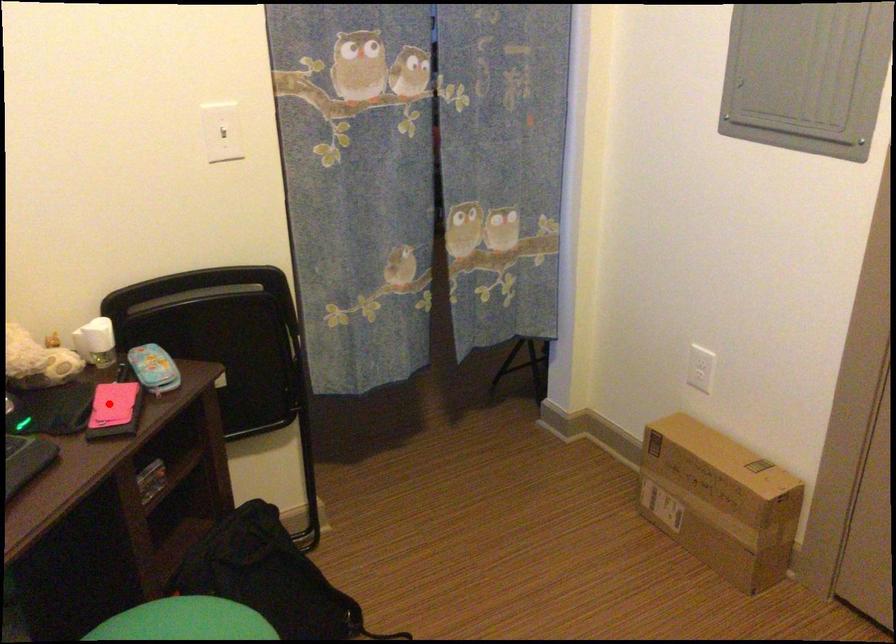
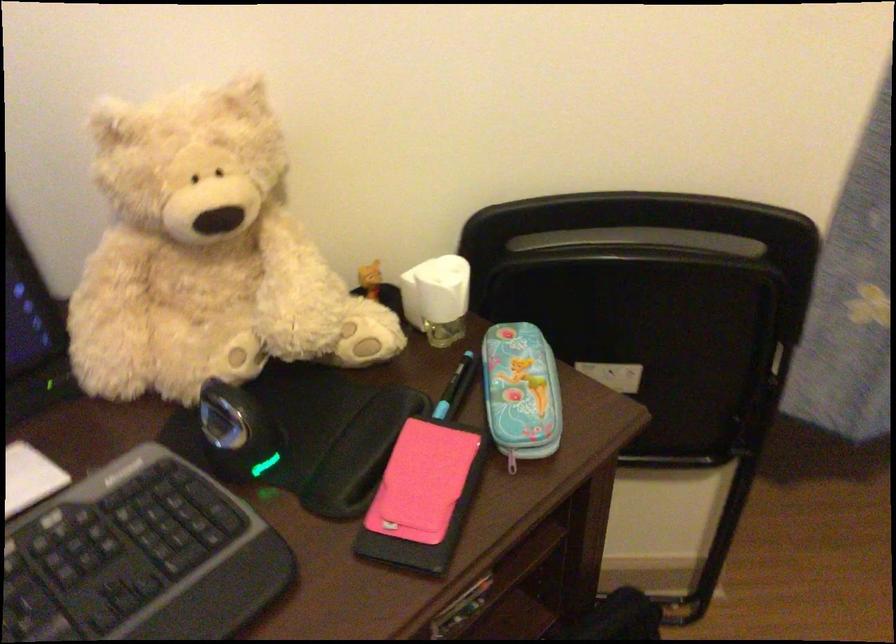
Question: I am providing you with two images of the same scene from different viewpoints. In image1, a red point is highlighted. Considering the same 3D point in image2, which of the following is correct?

Choices:
 (A) It is closer
 (B) It is farther

Answer: (A)